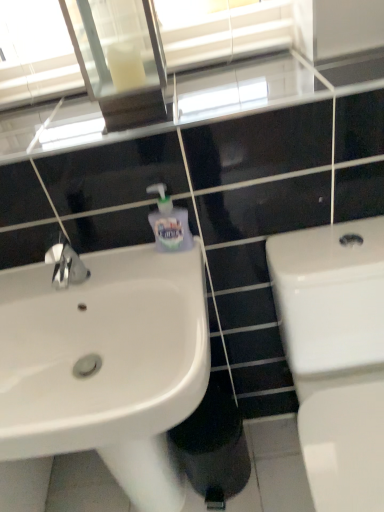
At what (x,y) coordinates should I click in order to perform the action: click on vacant space in front of clear glass mirror at upper center. Please return your answer as a coordinate pair (x, y). Image resolution: width=384 pixels, height=512 pixels. Looking at the image, I should click on (134, 119).